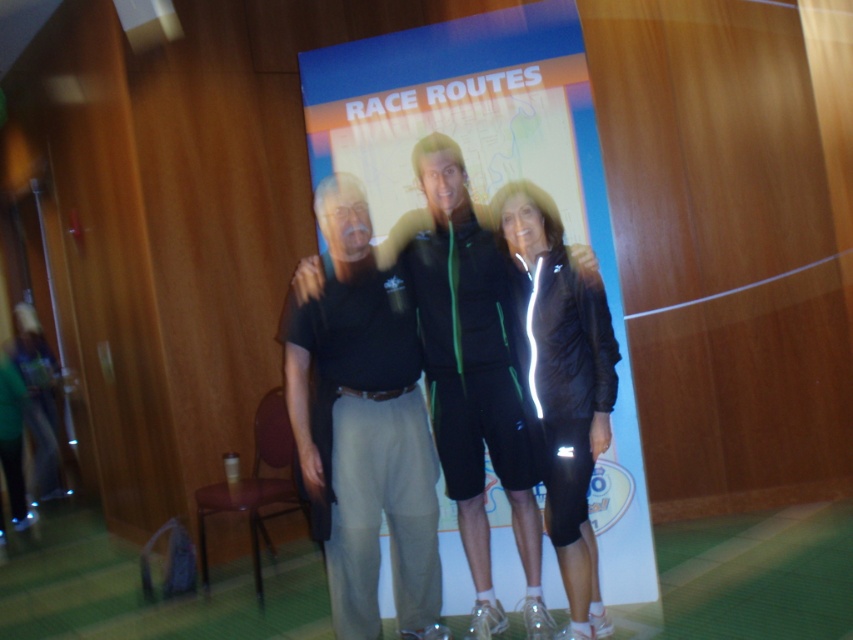
Question: Which of the following is the farthest from the observer?

Choices:
 (A) black matte jacket at center
 (B) black cotton shirt at center
 (C) green fabric tracksuit at center

Answer: (C)

Question: Is green fabric tracksuit at center below black matte jacket at center?

Choices:
 (A) yes
 (B) no

Answer: (B)

Question: Does black cotton shirt at center appear under green fabric tracksuit at center?

Choices:
 (A) yes
 (B) no

Answer: (A)

Question: Which point is farther from the camera taking this photo?

Choices:
 (A) (416, 173)
 (B) (323, 317)

Answer: (A)

Question: Which object is the closest to the black matte jacket at center?

Choices:
 (A) green fabric tracksuit at center
 (B) black cotton shirt at center

Answer: (A)

Question: Can you confirm if black cotton shirt at center is positioned above black matte jacket at center?

Choices:
 (A) no
 (B) yes

Answer: (A)